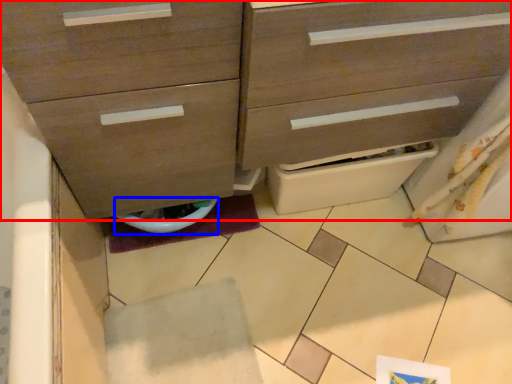
Question: Which point is closer to the camera, chest of drawers (highlighted by a red box) or toilet bowl (highlighted by a blue box)?

Choices:
 (A) chest of drawers
 (B) toilet bowl

Answer: (A)